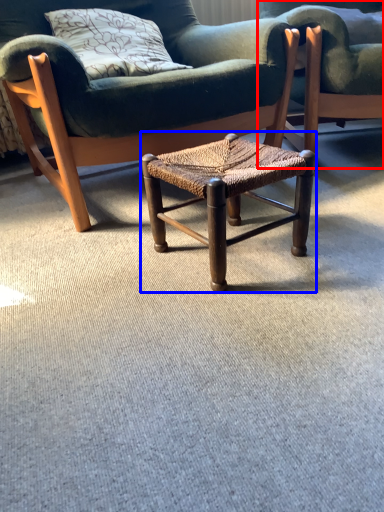
Question: Which object appears closest to the camera in this image, chair (highlighted by a red box) or stool (highlighted by a blue box)?

Choices:
 (A) chair
 (B) stool

Answer: (B)